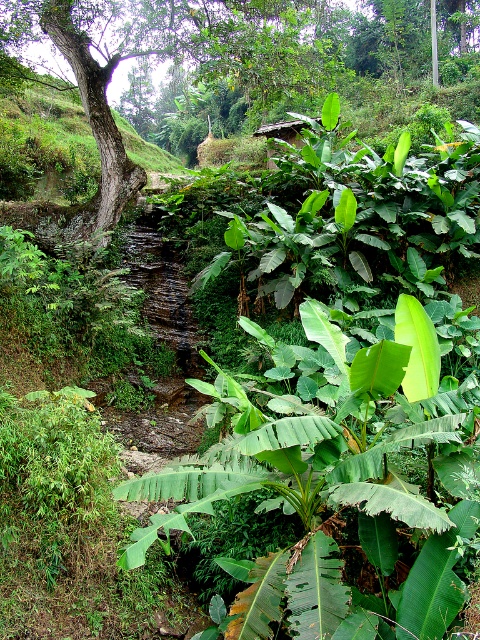
Describe the element at coordinates (339, 481) in the screenshot. This screenshot has height=640, width=480. I see `green leafy banana tree at center` at that location.

Where is `green leafy banana tree at center`? The image size is (480, 640). green leafy banana tree at center is located at coordinates (339, 481).